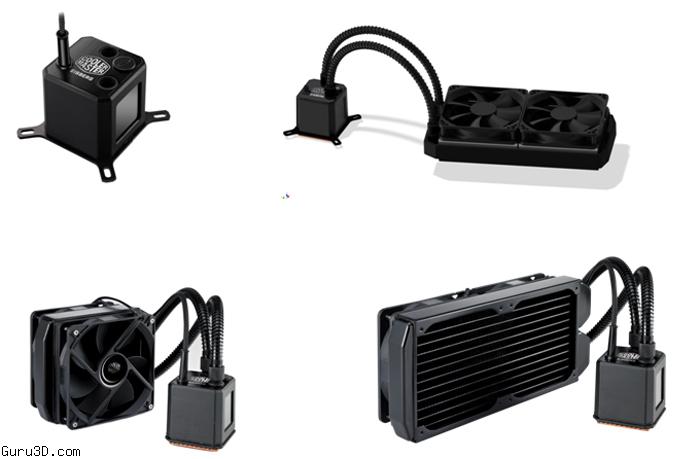
What are the coordinates of `fan` in the screenshot? It's located at (106, 386).